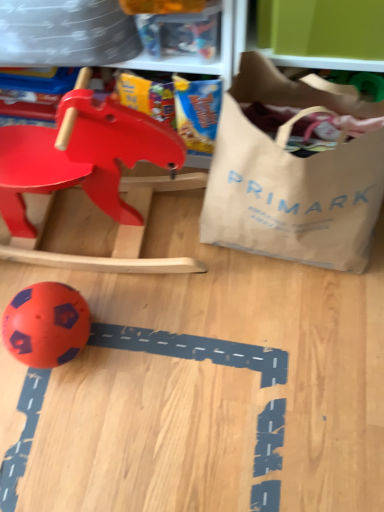
This screenshot has height=512, width=384. In order to click on spots to the right of orange rubber ball at lower left, positioned as the first toy in bottom-to-top order in this screenshot , I will do [x=125, y=332].